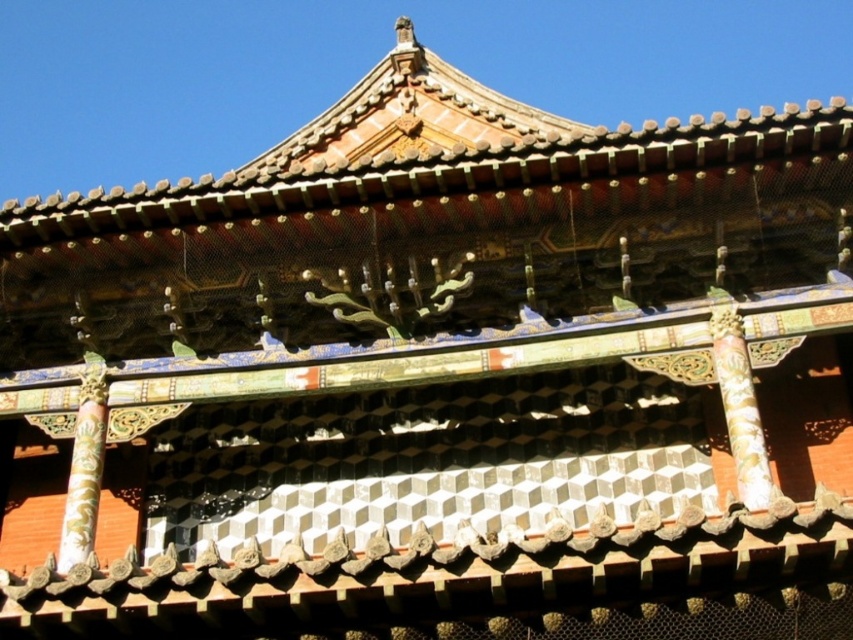
Question: Does gold-carved wooden pillar at center appear over gold-painted wood pillar at center-left?

Choices:
 (A) no
 (B) yes

Answer: (B)

Question: Is gold-carved wooden pillar at center below gold-painted wood pillar at center-left?

Choices:
 (A) no
 (B) yes

Answer: (A)

Question: Which object appears farthest from the camera in this image?

Choices:
 (A) gold-carved wooden pillar at center
 (B) gold-painted wood pillar at center-left

Answer: (B)

Question: Is the position of gold-carved wooden pillar at center less distant than that of gold-painted wood pillar at center-left?

Choices:
 (A) yes
 (B) no

Answer: (A)

Question: Which object is closer to the camera taking this photo?

Choices:
 (A) gold-carved wooden pillar at center
 (B) gold-painted wood pillar at center-left

Answer: (A)